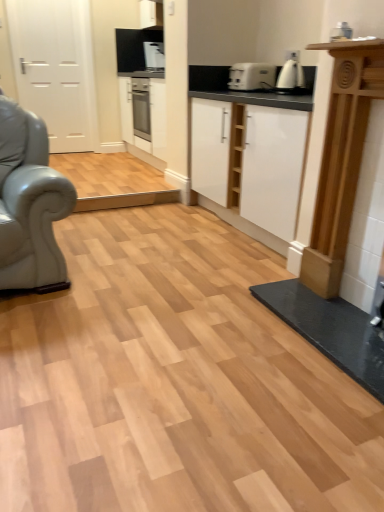
Question: Is white matte cabinet at center to the right of white glossy kettle at upper right, placed as the first coffee machine when sorted from right to left, from the viewer's perspective?

Choices:
 (A) yes
 (B) no

Answer: (B)

Question: Can you confirm if white matte cabinet at center is thinner than white glossy kettle at upper right, placed as the first coffee machine when sorted from right to left?

Choices:
 (A) yes
 (B) no

Answer: (B)

Question: Is white matte cabinet at center positioned with its back to white glossy kettle at upper right, placed as the first coffee machine when sorted from right to left?

Choices:
 (A) yes
 (B) no

Answer: (B)

Question: Can you confirm if white matte cabinet at center is wider than white glossy kettle at upper right, which is counted as the 2th coffee machine, starting from the left?

Choices:
 (A) no
 (B) yes

Answer: (B)

Question: Could you tell me if white matte cabinet at center is turned towards white glossy kettle at upper right, placed as the first coffee machine when sorted from right to left?

Choices:
 (A) no
 (B) yes

Answer: (A)

Question: Considering the relative sizes of white matte cabinet at center and white glossy kettle at upper right, placed as the first coffee machine when sorted from right to left, in the image provided, is white matte cabinet at center bigger than white glossy kettle at upper right, placed as the first coffee machine when sorted from right to left,?

Choices:
 (A) yes
 (B) no

Answer: (A)

Question: From a real-world perspective, is white plastic toaster at center under satin silver coffee machine at upper center, the second coffee machine when ordered from bottom to top?

Choices:
 (A) yes
 (B) no

Answer: (A)

Question: Is white plastic toaster at center not close to satin silver coffee machine at upper center, the 1th coffee machine viewed from the left?

Choices:
 (A) yes
 (B) no

Answer: (A)

Question: Does white plastic toaster at center have a larger size compared to satin silver coffee machine at upper center, the 1th coffee machine viewed from the left?

Choices:
 (A) no
 (B) yes

Answer: (B)

Question: Can you confirm if white plastic toaster at center is wider than satin silver coffee machine at upper center, the second coffee machine when ordered from bottom to top?

Choices:
 (A) yes
 (B) no

Answer: (A)

Question: Is white plastic toaster at center behind satin silver coffee machine at upper center, the 1th coffee machine viewed from the left?

Choices:
 (A) no
 (B) yes

Answer: (A)

Question: Is white plastic toaster at center oriented towards satin silver coffee machine at upper center, positioned as the 2th coffee machine in front-to-back order?

Choices:
 (A) yes
 (B) no

Answer: (B)

Question: Can you confirm if white glossy kettle at upper right, the first coffee machine from the bottom, is wider than white matte cabinet at center?

Choices:
 (A) no
 (B) yes

Answer: (A)